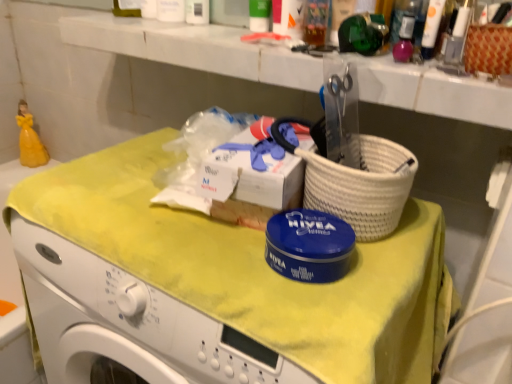
Question: Which direction should I rotate to look at translucent plastic cup at upper center, the 2th toiletry in the front-to-back sequence?

Choices:
 (A) left
 (B) right

Answer: (B)

Question: Is white glossy tube at upper right, the 3th toiletry in the left-to-right sequence, not close to translucent plastic cup at upper center, the second toiletry viewed from the right?

Choices:
 (A) yes
 (B) no

Answer: (B)

Question: Is white glossy tube at upper right, acting as the first toiletry starting from the front, thinner than translucent plastic cup at upper center, the 2th toiletry viewed from the left?

Choices:
 (A) no
 (B) yes

Answer: (A)

Question: Is the depth of white glossy tube at upper right, which is counted as the 3th toiletry, starting from the back, less than that of translucent plastic cup at upper center, the 2th toiletry viewed from the left?

Choices:
 (A) yes
 (B) no

Answer: (A)

Question: Is white glossy tube at upper right, the 3th toiletry in the left-to-right sequence, positioned beyond the bounds of translucent plastic cup at upper center, the 2th toiletry in the front-to-back sequence?

Choices:
 (A) yes
 (B) no

Answer: (A)

Question: Is white glossy tube at upper right, the 1th toiletry when ordered from right to left, wider than translucent plastic cup at upper center, the second toiletry viewed from the right?

Choices:
 (A) no
 (B) yes

Answer: (B)

Question: Can you confirm if white glossy tube at upper right, the 1th toiletry when ordered from right to left, is smaller than translucent plastic cup at upper center, the 2th toiletry in the front-to-back sequence?

Choices:
 (A) no
 (B) yes

Answer: (B)

Question: Can you confirm if translucent plastic cup at upper center, the 2th toiletry viewed from the left, is taller than yellow fabric at center?

Choices:
 (A) yes
 (B) no

Answer: (B)

Question: Is translucent plastic cup at upper center, the second toiletry viewed from the right, facing towards yellow fabric at center?

Choices:
 (A) no
 (B) yes

Answer: (A)

Question: Is translucent plastic cup at upper center, the second toiletry viewed from the right, at the right side of yellow fabric at center?

Choices:
 (A) yes
 (B) no

Answer: (A)

Question: Is translucent plastic cup at upper center, the 2th toiletry in the front-to-back sequence, oriented away from yellow fabric at center?

Choices:
 (A) yes
 (B) no

Answer: (B)

Question: Is translucent plastic cup at upper center, which ranks as the second toiletry in back-to-front order, positioned before yellow fabric at center?

Choices:
 (A) yes
 (B) no

Answer: (B)

Question: Are translucent plastic cup at upper center, the 2th toiletry in the front-to-back sequence, and yellow fabric at center far apart?

Choices:
 (A) yes
 (B) no

Answer: (B)

Question: Can you confirm if yellow fabric at center is positioned to the left of translucent plastic cup at upper center, the 2th toiletry in the front-to-back sequence?

Choices:
 (A) yes
 (B) no

Answer: (A)